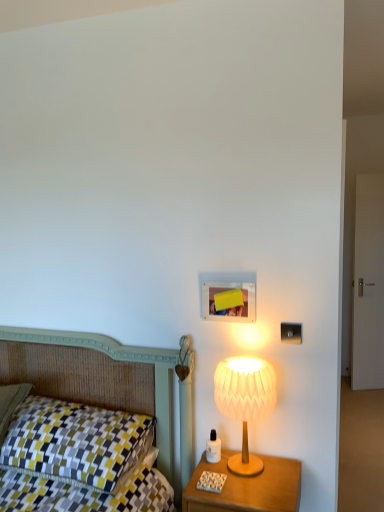
Locate an element on the screen. The width and height of the screenshot is (384, 512). vacant space in white paper lampshade at right (from a real-world perspective) is located at coordinates (252, 464).